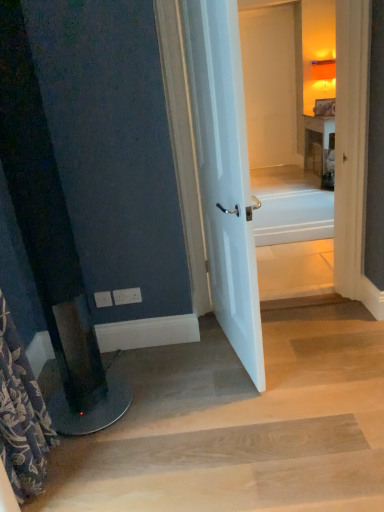
Question: Does white plastic electric outlet at lower left, the second electric outlet in the right-to-left sequence, have a lesser width compared to white glossy door at center?

Choices:
 (A) yes
 (B) no

Answer: (A)

Question: From a real-world perspective, does white plastic electric outlet at lower left, placed as the first electric outlet when sorted from left to right, sit lower than white glossy door at center?

Choices:
 (A) yes
 (B) no

Answer: (A)

Question: Does white plastic electric outlet at lower left, the second electric outlet in the right-to-left sequence, lie in front of white glossy door at center?

Choices:
 (A) yes
 (B) no

Answer: (B)

Question: From the image's perspective, is white plastic electric outlet at lower left, the second electric outlet in the right-to-left sequence, located above white glossy door at center?

Choices:
 (A) yes
 (B) no

Answer: (B)

Question: Does white plastic electric outlet at lower left, the second electric outlet in the right-to-left sequence, lie behind white glossy door at center?

Choices:
 (A) no
 (B) yes

Answer: (B)

Question: Considering the relative sizes of white plastic electric outlet at lower left, the second electric outlet in the right-to-left sequence, and white glossy door at center in the image provided, is white plastic electric outlet at lower left, the second electric outlet in the right-to-left sequence, bigger than white glossy door at center?

Choices:
 (A) no
 (B) yes

Answer: (A)

Question: From a real-world perspective, is floral fabric shower curtain at left under light brown wood at lower center?

Choices:
 (A) no
 (B) yes

Answer: (A)

Question: Considering the relative sizes of floral fabric shower curtain at left and light brown wood at lower center in the image provided, is floral fabric shower curtain at left taller than light brown wood at lower center?

Choices:
 (A) yes
 (B) no

Answer: (A)

Question: Can you see floral fabric shower curtain at left touching light brown wood at lower center?

Choices:
 (A) no
 (B) yes

Answer: (A)

Question: Considering the relative sizes of floral fabric shower curtain at left and light brown wood at lower center in the image provided, is floral fabric shower curtain at left bigger than light brown wood at lower center?

Choices:
 (A) no
 (B) yes

Answer: (A)

Question: Is floral fabric shower curtain at left smaller than light brown wood at lower center?

Choices:
 (A) no
 (B) yes

Answer: (B)

Question: From a real-world perspective, is floral fabric shower curtain at left located higher than light brown wood at lower center?

Choices:
 (A) yes
 (B) no

Answer: (A)

Question: From a real-world perspective, is floral fabric shower curtain at left beneath white plastic electric outlet at lower left, placed as the first electric outlet when sorted from left to right?

Choices:
 (A) yes
 (B) no

Answer: (B)